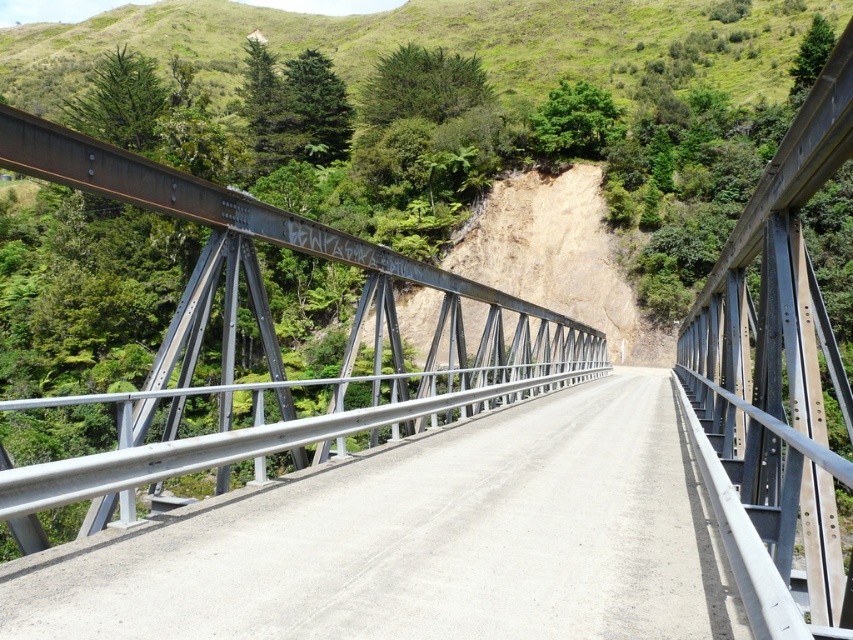
Looking at this image, is smooth concrete road at center to the right of green grassy hillside at upper center from the viewer's perspective?

Yes, smooth concrete road at center is to the right of green grassy hillside at upper center.

Who is taller, smooth concrete road at center or green grassy hillside at upper center?

green grassy hillside at upper center

Who is more forward, (728,618) or (532,195)?

Point (728,618) is more forward.

Where is `smooth concrete road at center`? The width and height of the screenshot is (853, 640). smooth concrete road at center is located at coordinates (422, 540).

Who is taller, metallic gray bridge at center or green grassy hillside at upper center?

green grassy hillside at upper center is taller.

Can you confirm if metallic gray bridge at center is positioned above green grassy hillside at upper center?

Actually, metallic gray bridge at center is below green grassy hillside at upper center.

Measure the distance between point [364,356] and camera.

Point [364,356] is 42.39 meters away from camera.

You are a GUI agent. You are given a task and a screenshot of the screen. Output one action in this format:
    pyautogui.click(x=<x>, y=<y>)
    Task: Click on the metallic gray bridge at center
    Image resolution: width=853 pixels, height=640 pixels.
    Given the screenshot: What is the action you would take?
    pyautogui.click(x=263, y=348)

Is point (511, 477) farther from viewer compared to point (190, 444)?

Yes.

In the scene shown: Does smooth concrete road at center have a greater height compared to metallic gray bridge at center?

No, smooth concrete road at center is not taller than metallic gray bridge at center.

Image resolution: width=853 pixels, height=640 pixels. Find the location of `smooth concrete road at center`. smooth concrete road at center is located at coordinates (422, 540).